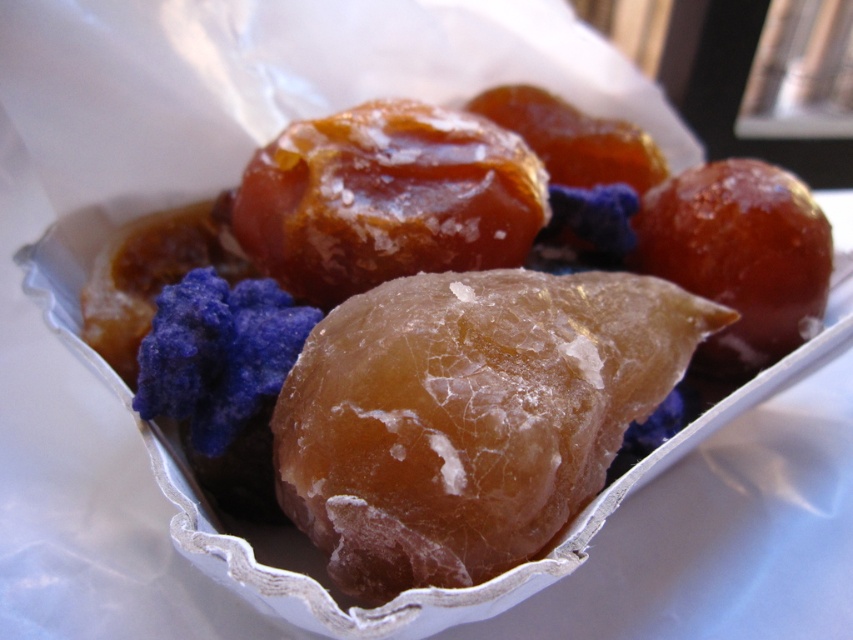
You are at a dessert table and see a white paper tray with two caramel items. The glossy caramel treat at center and the glossy caramel candy at center. Which one is located below the other?

The glossy caramel treat at center is positioned under the glossy caramel candy at center.

You are trying to decide which item to pick up first from the white paper tray. Both the glossy caramel treat at center and the glossy caramel candy at center are in front of you. Which one is taller?

The glossy caramel treat at center is taller than the glossy caramel candy at center.

Consider the image. You are a food stylist arranging items in the white paper tray. You need to place a new candy between the two points labeled point (439,250) and point (300,268). Which point should you place it closer to if you want the candy to appear larger in the photo?

You should place the new candy closer to point (439,250) because it is closer to the camera than point (300,268), so objects near it will appear larger in the photo.